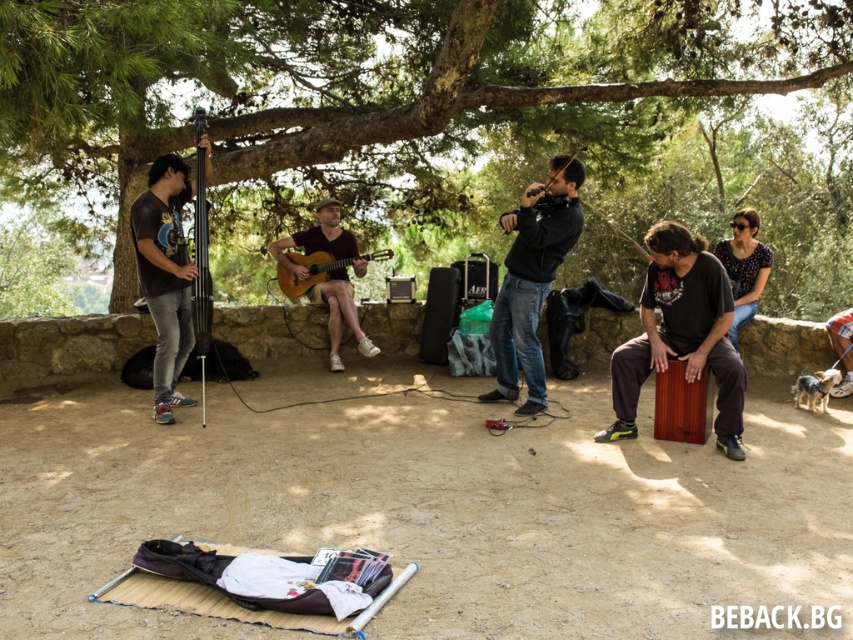
Question: Which of these objects is positioned closest to the wooden acoustic guitar at center?

Choices:
 (A) matte brown guitar at center
 (B) black matte bass guitar at left
 (C) black matte jacket at center
 (D) matte black camera at center

Answer: (A)

Question: Does wooden cajon at center appear under matte brown guitar at center?

Choices:
 (A) no
 (B) yes

Answer: (B)

Question: Is matte brown guitar at center to the right of matte black camera at center from the viewer's perspective?

Choices:
 (A) yes
 (B) no

Answer: (B)

Question: Is matte brown guitar at center to the right of black matte bass guitar at left from the viewer's perspective?

Choices:
 (A) yes
 (B) no

Answer: (A)

Question: Estimate the real-world distances between objects in this image. Which object is farther from the black matte bass guitar at left?

Choices:
 (A) wooden acoustic guitar at center
 (B) wooden cajon at center
 (C) matte black camera at center

Answer: (B)

Question: Which point appears closest to the camera in this image?

Choices:
 (A) (364, 256)
 (B) (0, 264)
 (C) (137, 241)

Answer: (C)